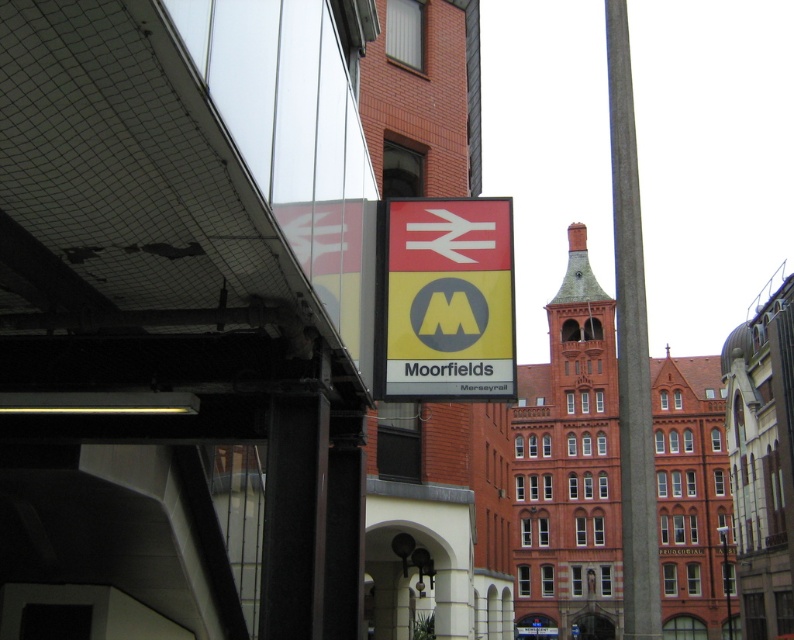
Question: Which of the following is the farthest from the observer?

Choices:
 (A) (511, 250)
 (B) (619, 266)

Answer: (B)

Question: Can you confirm if yellow matte sign at center is bigger than concrete pole at right?

Choices:
 (A) no
 (B) yes

Answer: (A)

Question: Considering the relative positions of yellow matte sign at center and concrete pole at right in the image provided, where is yellow matte sign at center located with respect to concrete pole at right?

Choices:
 (A) right
 (B) left

Answer: (B)

Question: Is yellow matte sign at center further to camera compared to concrete pole at right?

Choices:
 (A) no
 (B) yes

Answer: (A)

Question: Which point is closer to the camera taking this photo?

Choices:
 (A) (488, 225)
 (B) (640, 500)

Answer: (A)

Question: Among these points, which one is farthest from the camera?

Choices:
 (A) (471, 269)
 (B) (619, 49)

Answer: (B)